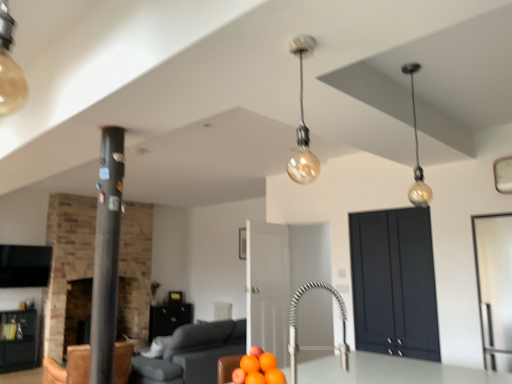
Question: Is matte gray sofa at lower center surrounded by dark matte cabinet at center right, which appears as the third cabinetry when viewed from the back?

Choices:
 (A) yes
 (B) no

Answer: (B)

Question: Is dark matte cabinet at center right, the first cabinetry positioned from the right, to the left of matte gray sofa at lower center from the viewer's perspective?

Choices:
 (A) no
 (B) yes

Answer: (A)

Question: Does dark matte cabinet at center right, the first cabinetry positioned from the right, have a greater width compared to matte gray sofa at lower center?

Choices:
 (A) yes
 (B) no

Answer: (B)

Question: Is dark matte cabinet at center right, the first cabinetry positioned from the right, facing towards matte gray sofa at lower center?

Choices:
 (A) yes
 (B) no

Answer: (B)

Question: Is dark matte cabinet at center right, which is the 1th cabinetry from front to back, thinner than matte gray sofa at lower center?

Choices:
 (A) yes
 (B) no

Answer: (A)

Question: From the image's perspective, is dark matte cabinet at center right, which is the 1th cabinetry in top-to-bottom order, over matte gray sofa at lower center?

Choices:
 (A) no
 (B) yes

Answer: (B)

Question: From the image's perspective, is brick fireplace at left, which appears as the 2th fireplace when viewed from the left, on black matte pillar at left?

Choices:
 (A) no
 (B) yes

Answer: (A)

Question: Considering the relative positions of brick fireplace at left, the 1th fireplace positioned from the right, and black matte pillar at left in the image provided, is brick fireplace at left, the 1th fireplace positioned from the right, to the right of black matte pillar at left from the viewer's perspective?

Choices:
 (A) no
 (B) yes

Answer: (A)

Question: Considering the relative sizes of brick fireplace at left, the 1th fireplace positioned from the right, and black matte pillar at left in the image provided, is brick fireplace at left, the 1th fireplace positioned from the right, wider than black matte pillar at left?

Choices:
 (A) yes
 (B) no

Answer: (A)

Question: Would you say black matte pillar at left is part of brick fireplace at left, the 1th fireplace positioned from the right,'s contents?

Choices:
 (A) no
 (B) yes

Answer: (A)

Question: Is brick fireplace at left, the 1th fireplace positioned from the right, at the left side of black matte pillar at left?

Choices:
 (A) yes
 (B) no

Answer: (A)

Question: Does brick fireplace at left, which appears as the 2th fireplace when viewed from the left, come in front of leather armchair at lower left?

Choices:
 (A) yes
 (B) no

Answer: (B)